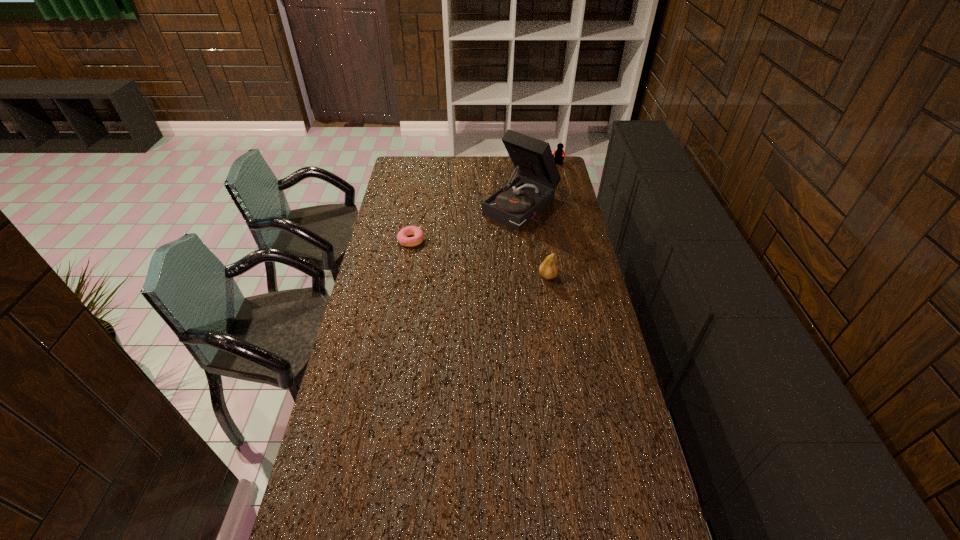
I want to click on free spot on the desktop that is between the shortest object and the pear and is positioned on the front-facing side of the phonograph_record, so click(x=462, y=253).

In order to click on free space on the desktop that is between the doughnut and the nearest object and is positioned on the front-facing side of the farthest object in this screenshot , I will do `click(467, 254)`.